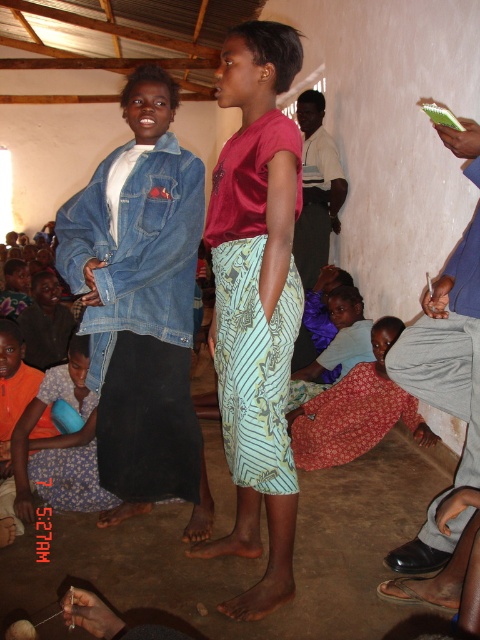
Question: Does denim jacket at left appear on the right side of dark blue jeans at lower right?

Choices:
 (A) yes
 (B) no

Answer: (B)

Question: Which of the following is the farthest from the observer?

Choices:
 (A) dark blue jeans at lower right
 (B) printed fabric dress at lower center
 (C) silky pink blouse at center

Answer: (B)

Question: Is silky pink blouse at center bigger than orange fabric cloth at lower left?

Choices:
 (A) no
 (B) yes

Answer: (B)

Question: Which object appears farthest from the camera in this image?

Choices:
 (A) dark blue jeans at lower right
 (B) orange fabric cloth at lower left

Answer: (B)

Question: Which object is farther from the camera taking this photo?

Choices:
 (A) printed fabric dress at lower center
 (B) denim jacket at left

Answer: (A)

Question: Is dark blue jeans at lower right bigger than orange fabric cloth at lower left?

Choices:
 (A) no
 (B) yes

Answer: (B)